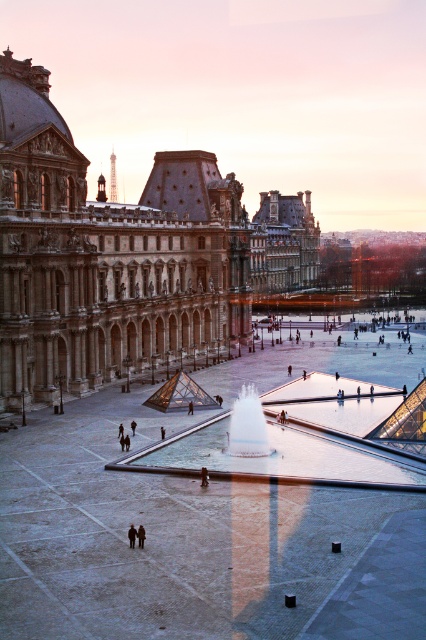
Question: Which is farther from the silhouette fabric person at center?

Choices:
 (A) black glossy person at center
 (B) white glossy fountain at center
 (C) transparent glass fountain at center

Answer: (C)

Question: Estimate the real-world distances between objects in this image. Which object is farther from the transparent glass fountain at center?

Choices:
 (A) dark brown leather coat at lower center
 (B) white glossy fountain at center

Answer: (A)

Question: Can you confirm if dark brown leather coat at center is bigger than dark gray fabric coat at center?

Choices:
 (A) yes
 (B) no

Answer: (B)

Question: Estimate the real-world distances between objects in this image. Which object is farther from the brown stone building at center?

Choices:
 (A) silhouette fabric person at center
 (B) black glossy person at center
 (C) white glossy fountain at center

Answer: (A)

Question: Is transparent glass fountain at center further to camera compared to white glossy fountain at center?

Choices:
 (A) yes
 (B) no

Answer: (B)

Question: Does brown stone building at center have a greater width compared to white glossy fountain at center?

Choices:
 (A) yes
 (B) no

Answer: (A)